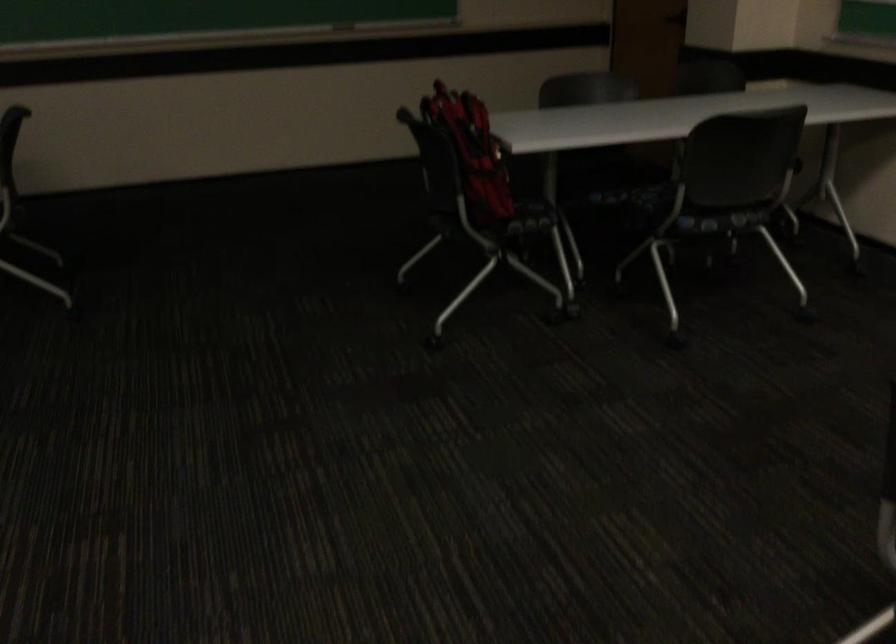
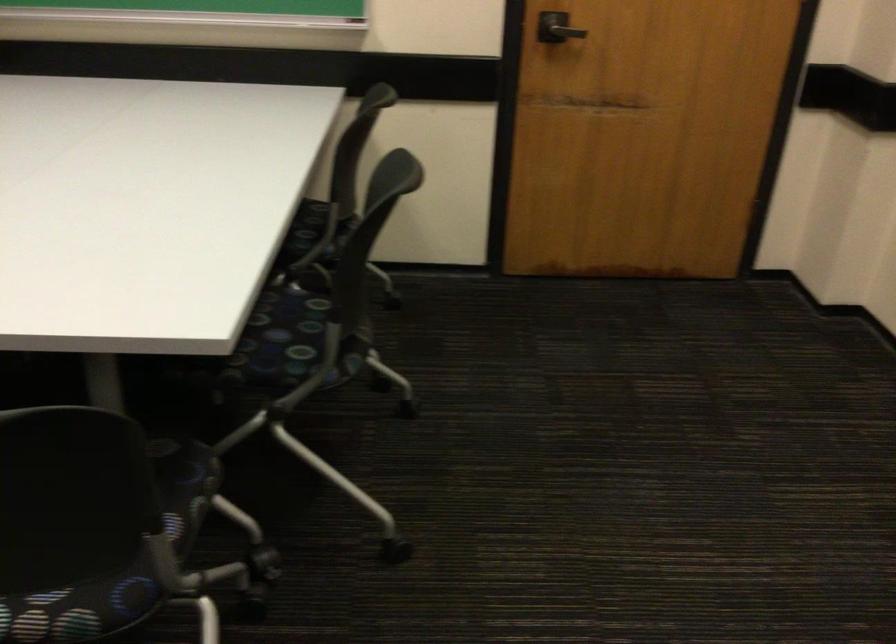
In the scene shown: How did the camera likely rotate?

The rotation direction of the camera is right-down.